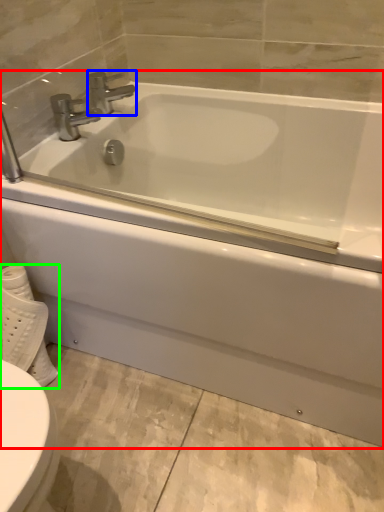
Question: Which is nearer to the bathtub (highlighted by a red box)? tap (highlighted by a blue box) or toilet paper (highlighted by a green box).

Choices:
 (A) tap
 (B) toilet paper

Answer: (B)